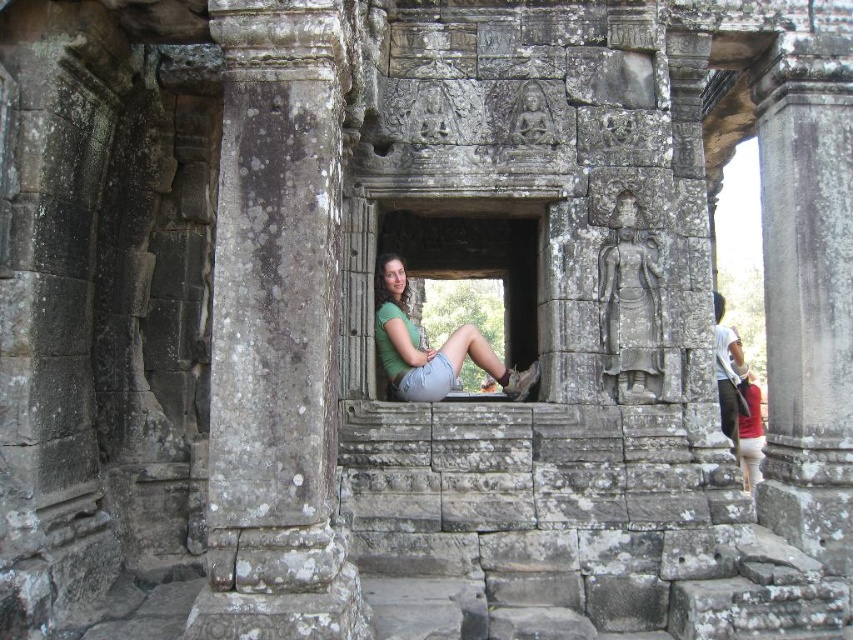
You are an archaeologist examining the ancient stone structure. You notice the gray stone column at left and the white cotton shirt at center. Which object is positioned higher in the image?

The gray stone column at left is located above the white cotton shirt at center, so it is positioned higher in the image.